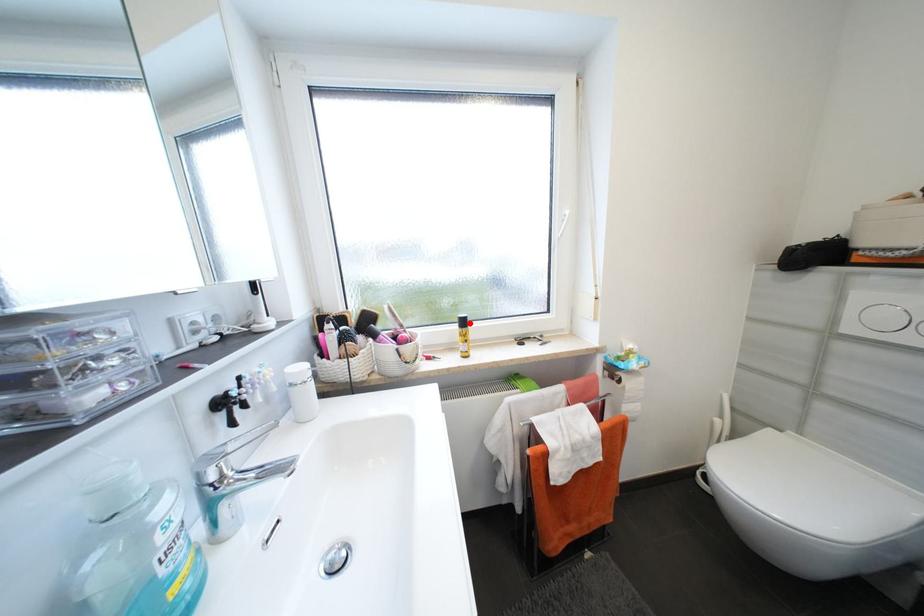
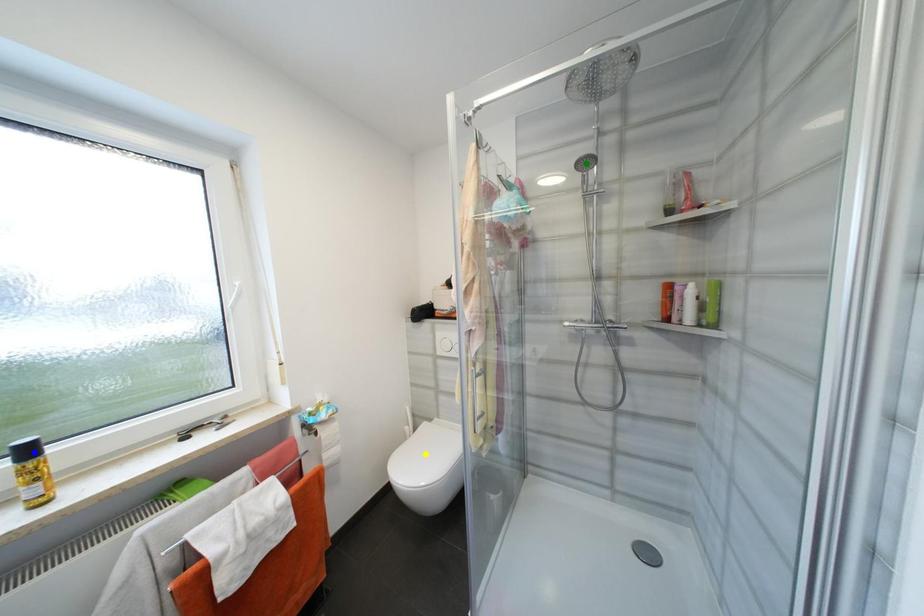
Question: I am providing you with two images of the same scene from different viewpoints. A red point is marked on the first image. You are given multiple points on the second image. In image 2, which mark is for the same physical point as the one in image 1?

Choices:
 (A) yellow point
 (B) blue point
 (C) green point

Answer: (B)